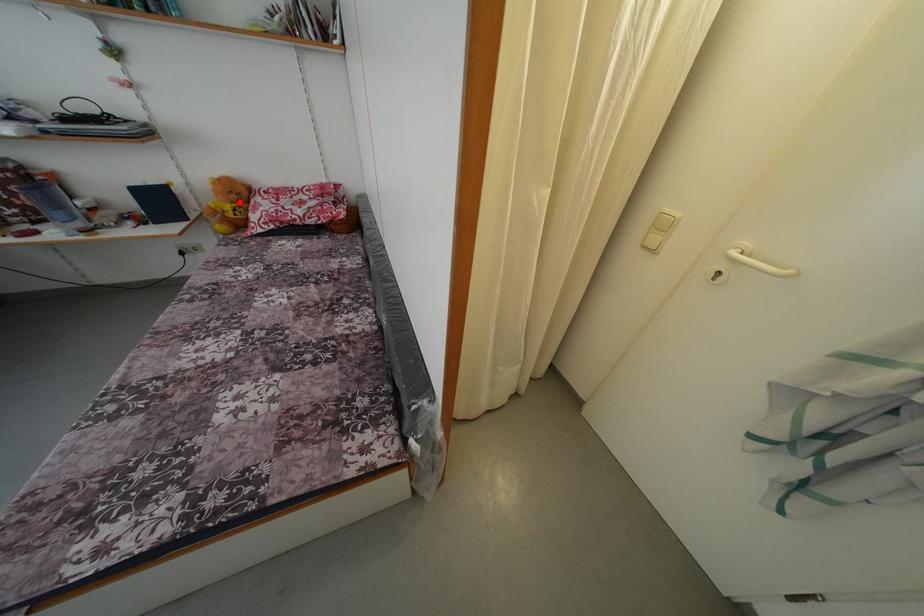
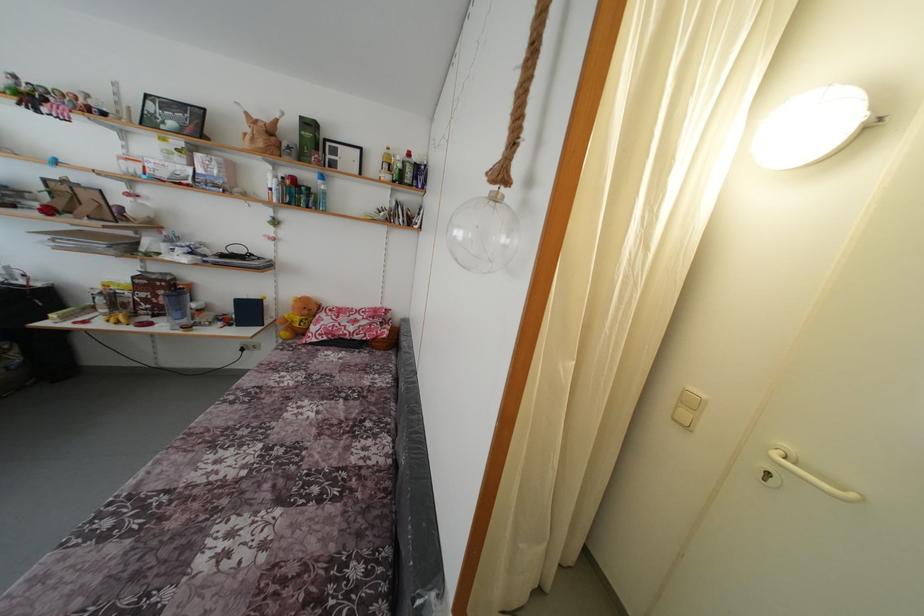
Where in the second image is the point corresponding to the highlighted location from the first image?

(310, 317)